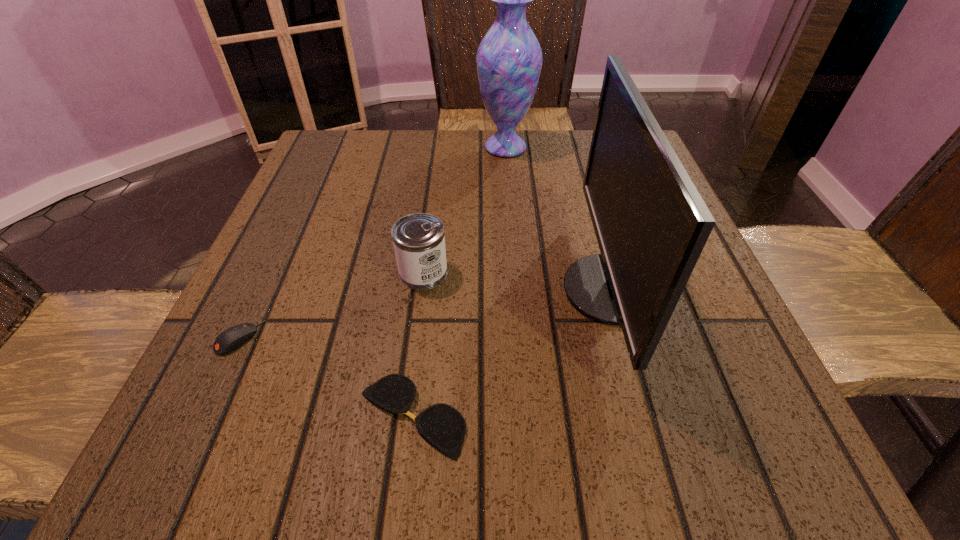
This screenshot has width=960, height=540. I want to click on free space that is in between the rightmost object and the vase, so click(x=558, y=219).

The image size is (960, 540). I want to click on vacant space that is in between the third tallest object and the computer mouse, so click(331, 305).

Locate an element on the screen. This screenshot has height=540, width=960. empty space between the shortest object and the monitor is located at coordinates (512, 353).

You are a GUI agent. You are given a task and a screenshot of the screen. Output one action in this format:
    pyautogui.click(x=<x>, y=<y>)
    Task: Click on the object that stands as the second closest to the rightmost object
    
    Given the screenshot: What is the action you would take?
    pyautogui.click(x=419, y=242)

Find the location of a particular element. This screenshot has width=960, height=540. object that can be found as the closest to the leftmost object is located at coordinates (442, 425).

I want to click on free space that satisfies the following two spatial constraints: 1. on the back side of the fourth object from left to right; 2. on the right side of the second shortest object, so click(x=327, y=147).

Identify the location of vacant space that satisfies the following two spatial constraints: 1. on the back side of the second shortest object; 2. on the left side of the third shortest object. (270, 273).

Identify the location of vacant position in the image that satisfies the following two spatial constraints: 1. on the screen side of the rightmost object; 2. on the front side of the shortest object. (645, 416).

Where is `vacant space that satisfies the following two spatial constraints: 1. on the front side of the spectacles; 2. on the right side of the third tallest object`? This screenshot has height=540, width=960. vacant space that satisfies the following two spatial constraints: 1. on the front side of the spectacles; 2. on the right side of the third tallest object is located at coordinates (405, 416).